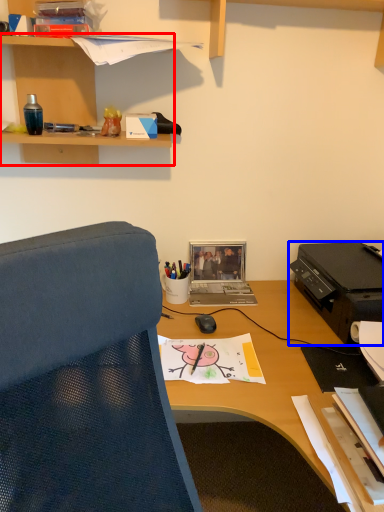
Question: Which object appears farthest to the camera in this image, shelf (highlighted by a red box) or printer (highlighted by a blue box)?

Choices:
 (A) shelf
 (B) printer

Answer: (B)